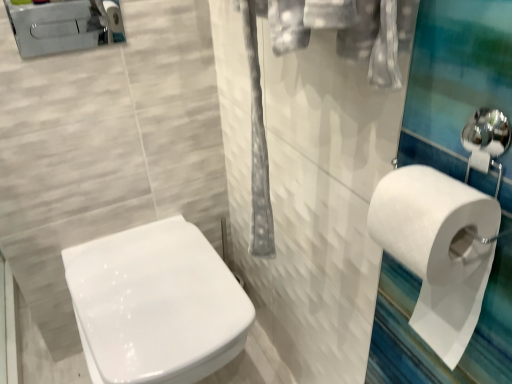
Question: Can you confirm if white matte toilet paper at right is positioned to the left of brushed metal toilet at upper left?

Choices:
 (A) no
 (B) yes

Answer: (A)

Question: Can you confirm if white matte toilet paper at right is smaller than brushed metal toilet at upper left?

Choices:
 (A) yes
 (B) no

Answer: (B)

Question: Is white matte toilet paper at right aimed at brushed metal toilet at upper left?

Choices:
 (A) yes
 (B) no

Answer: (B)

Question: From the image's perspective, is white matte toilet paper at right over brushed metal toilet at upper left?

Choices:
 (A) no
 (B) yes

Answer: (A)

Question: Is white matte toilet paper at right bigger than brushed metal toilet at upper left?

Choices:
 (A) yes
 (B) no

Answer: (A)

Question: Is white matte toilet paper at right at the right side of brushed metal toilet at upper left?

Choices:
 (A) no
 (B) yes

Answer: (B)

Question: Can you confirm if white glossy toilet at center is wider than white matte toilet paper at right?

Choices:
 (A) yes
 (B) no

Answer: (A)

Question: Is white glossy toilet at center behind white matte toilet paper at right?

Choices:
 (A) no
 (B) yes

Answer: (B)

Question: Considering the relative sizes of white glossy toilet at center and white matte toilet paper at right in the image provided, is white glossy toilet at center thinner than white matte toilet paper at right?

Choices:
 (A) yes
 (B) no

Answer: (B)

Question: Considering the relative sizes of white glossy toilet at center and white matte toilet paper at right in the image provided, is white glossy toilet at center shorter than white matte toilet paper at right?

Choices:
 (A) yes
 (B) no

Answer: (B)

Question: Is white glossy toilet at center not near white matte toilet paper at right?

Choices:
 (A) yes
 (B) no

Answer: (B)

Question: Does white glossy toilet at center appear on the left side of white matte toilet paper at right?

Choices:
 (A) yes
 (B) no

Answer: (A)

Question: From a real-world perspective, is brushed metal toilet at upper left physically above white matte toilet paper at right?

Choices:
 (A) no
 (B) yes

Answer: (B)